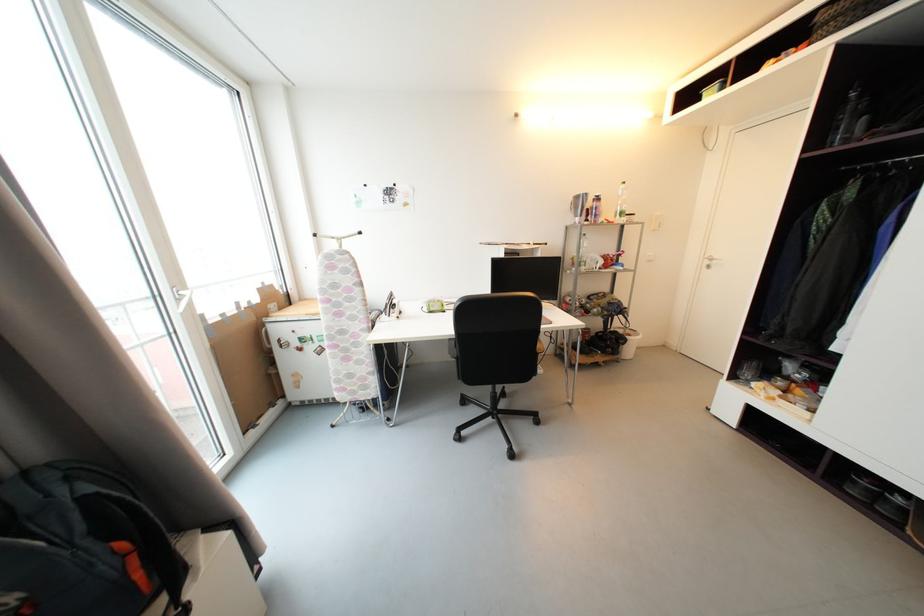
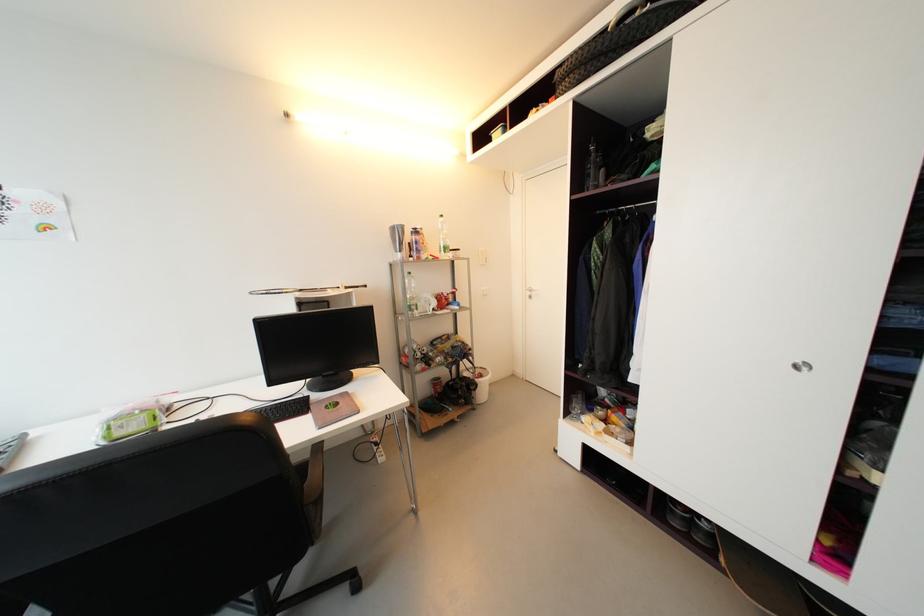
Where in the second image is the point corresponding to (x=636, y=338) from the first image?

(487, 378)